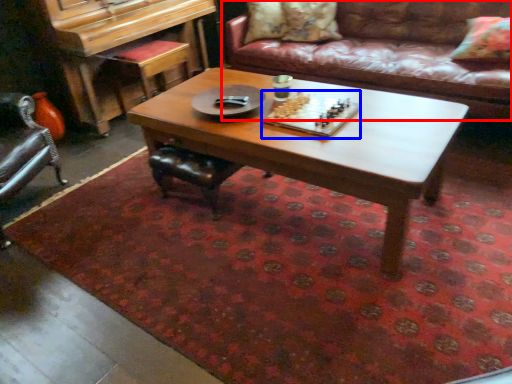
Question: Among these objects, which one is nearest to the camera, studio couch (highlighted by a red box) or board game (highlighted by a blue box)?

Choices:
 (A) studio couch
 (B) board game

Answer: (B)